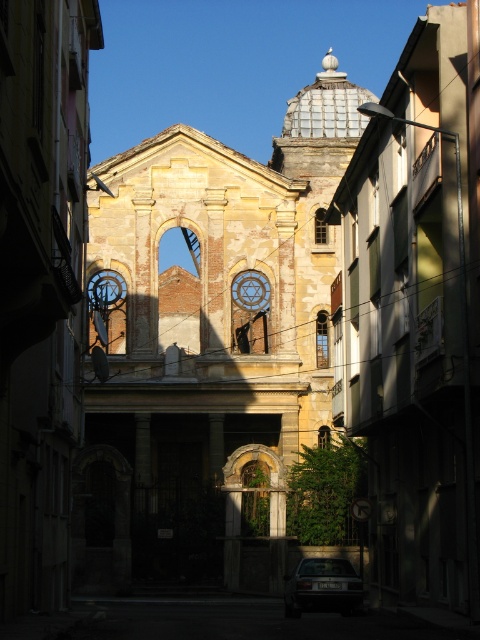
This screenshot has width=480, height=640. Describe the element at coordinates (211, 348) in the screenshot. I see `yellow stone church at center` at that location.

From the picture: How far apart are yellow stone church at center and dark gray metallic car at lower center?

yellow stone church at center is 87.69 feet away from dark gray metallic car at lower center.

The height and width of the screenshot is (640, 480). Identify the location of yellow stone church at center. (211, 348).